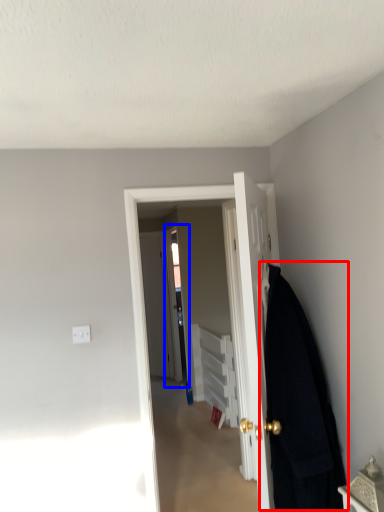
Question: Which object is further to the camera taking this photo, blanket (highlighted by a red box) or screen door (highlighted by a blue box)?

Choices:
 (A) blanket
 (B) screen door

Answer: (B)